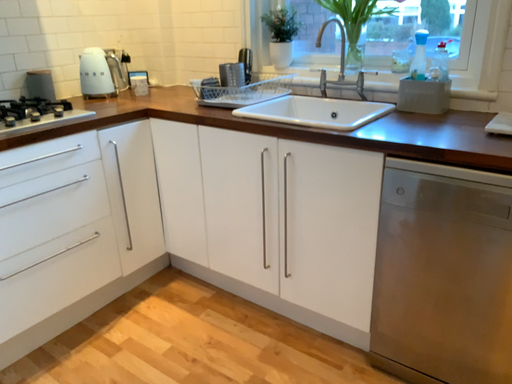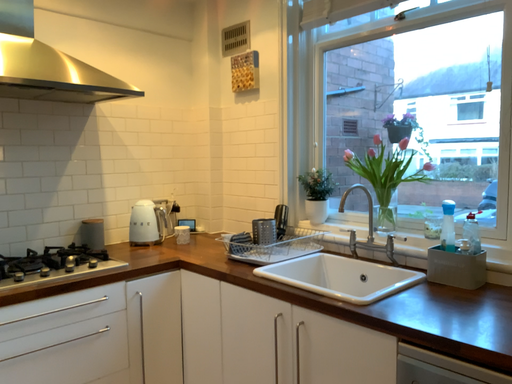
Question: How did the camera likely rotate when shooting the video?

Choices:
 (A) rotated downward
 (B) rotated upward

Answer: (B)